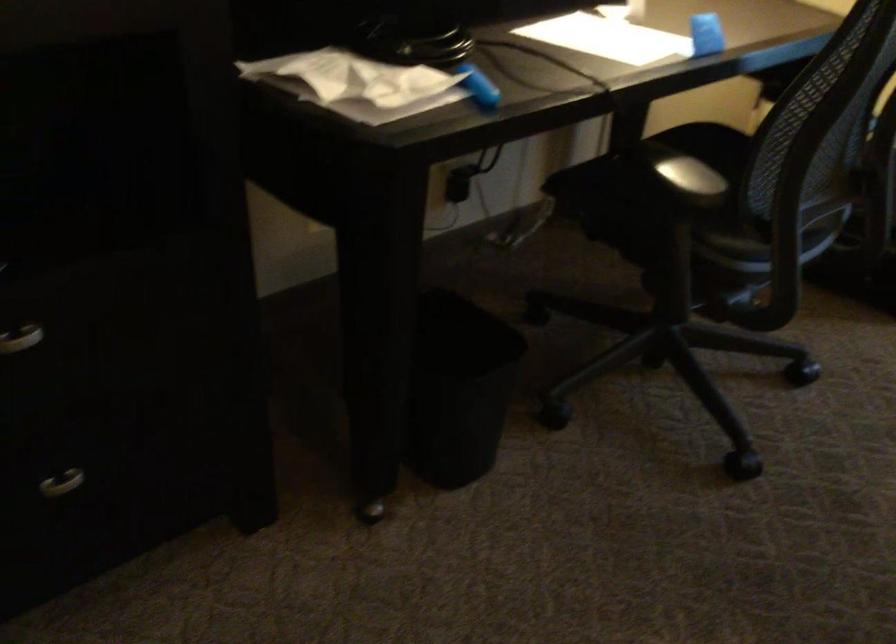
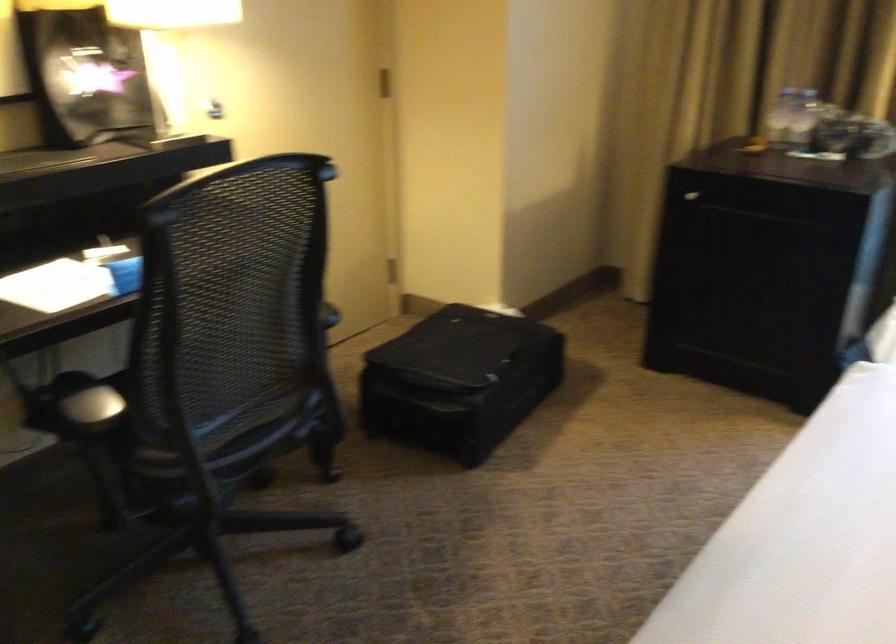
The images are taken continuously from a first-person perspective. In which direction are you moving?

The movement direction of the cameraman is right, backward.